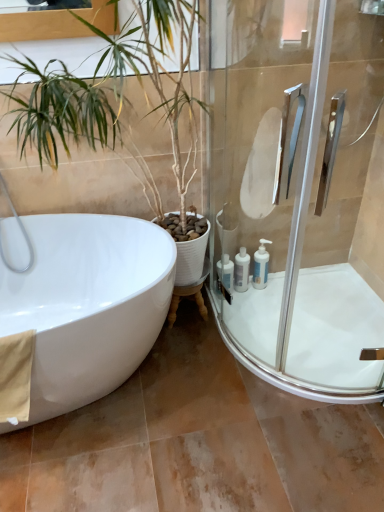
I want to click on free space in front of white glossy bottle at lower right, the second toiletry when ordered from left to right, so click(x=245, y=313).